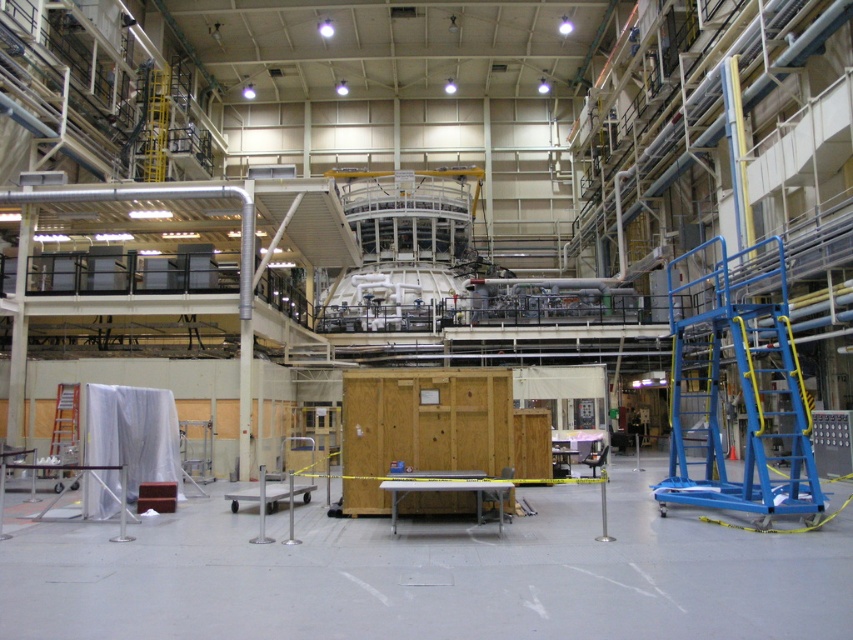
You are a maintenance worker needing to access the central machinery in the industrial facility. You see the blue metallic platform at right and the silver metallic ladder at left. Which object is closer to you as you stand facing the machinery?

The blue metallic platform at right is closer to you because it is in front of the silver metallic ladder at left, meaning it is positioned between you and the ladder.

You are an engineer in the industrial facility. You need to move the silver metallic ladder at left closer to the metallic gray table at center. Is there enough space between them to do this?

The metallic gray table at center occupies less space than the silver metallic ladder at left, so there is sufficient space to move the silver metallic ladder at left closer to the metallic gray table at center.

You are a technician needing to place a heavy tool on the higher object in the scene. Which object should you choose between the blue metallic platform at right and the metallic gray table at center?

The blue metallic platform at right has a greater height compared to the metallic gray table at center, so you should place the heavy tool on the blue metallic platform at right.